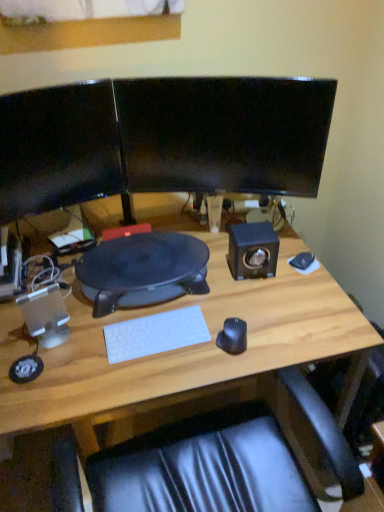
Locate an element on the screen. free location in front of white matte mousepad at right is located at coordinates (306, 294).